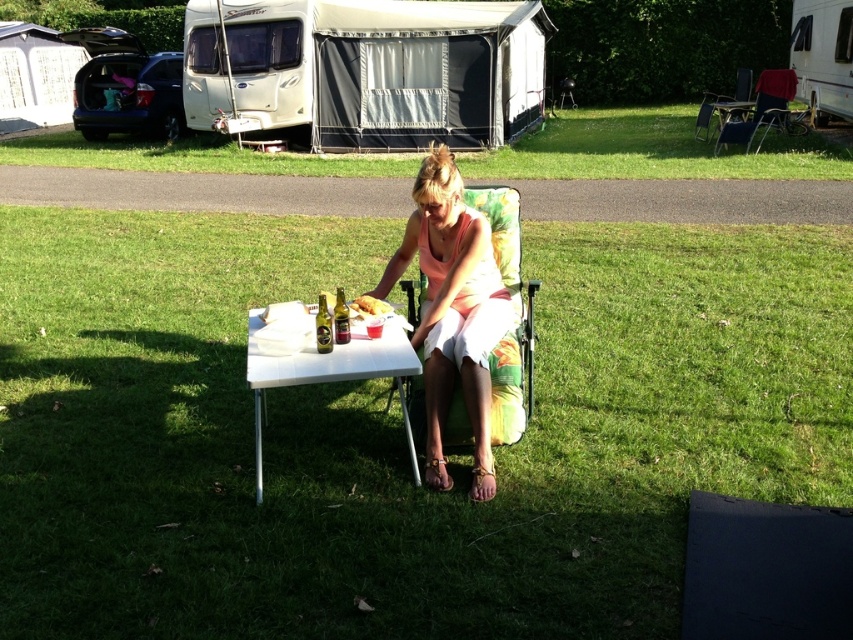
You are a photographer setting up a shot of the woman and the items on the table. You need to ensure the matte peach tank top at center is visible above the metallic gold can at center in the photo. Based on their heights, will this arrangement naturally occur?

The matte peach tank top at center is taller than the metallic gold can at center, so yes, the arrangement will naturally have the matte peach tank top at center visible above the metallic gold can at center in the photo.

Consider the image. You are planning to set up a tent in this campsite. You have a white fabric camper at upper center and a red fabric chair at upper right. Which object is shorter and thus more suitable for placing under a low tree branch that is 1.5 meters high?

The white fabric camper at upper center is shorter than the red fabric chair at upper right, so it is more suitable for placing under the low tree branch that is 1.5 meters high.

In the scene shown: Please provide the 2D coordinates of the green grass at center in the image. The coordinates should be in the format of a point with two decimal places, like this example format point_x, point_y. Please do not add any other information except the coordinates.

The 2D coordinates of the green grass at center are at point (x=393, y=429).